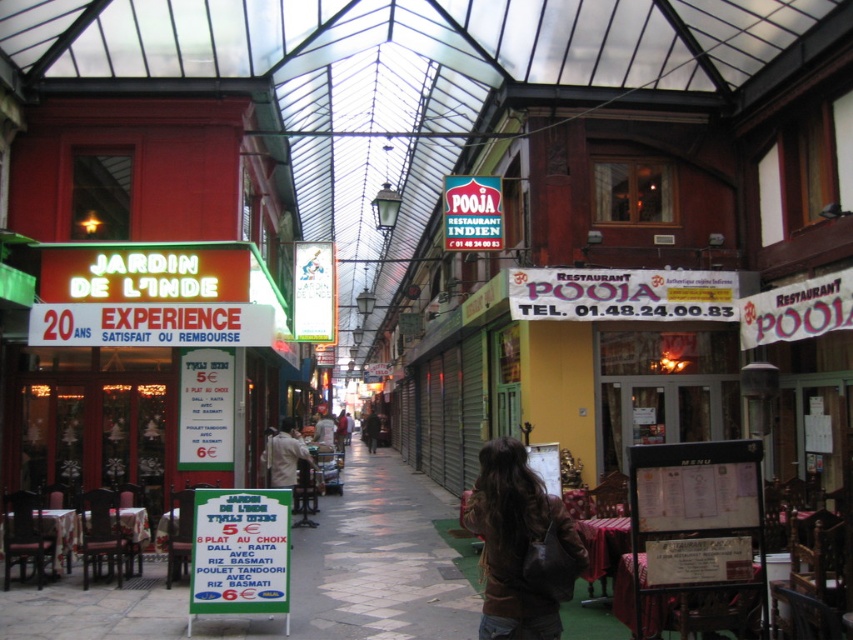
Question: Is green plastic signboard at center below light brown leather jacket at center?

Choices:
 (A) no
 (B) yes

Answer: (A)

Question: Which point appears closest to the camera in this image?

Choices:
 (A) (280, 424)
 (B) (252, 573)
 (C) (491, 246)

Answer: (B)

Question: Which of the following is the farthest from the observer?

Choices:
 (A) dark brown leather jacket at center
 (B) light brown leather jacket at center
 (C) matte plastic sign at center

Answer: (A)

Question: Which point is farther to the camera?

Choices:
 (A) green plastic signboard at center
 (B) light brown leather jacket at center

Answer: (B)

Question: Does brown leather jacket at center have a smaller size compared to green plastic signboard at center?

Choices:
 (A) no
 (B) yes

Answer: (B)

Question: Observing the image, what is the correct spatial positioning of green plastic signboard at center in reference to dark brown leather jacket at center?

Choices:
 (A) below
 (B) above

Answer: (B)